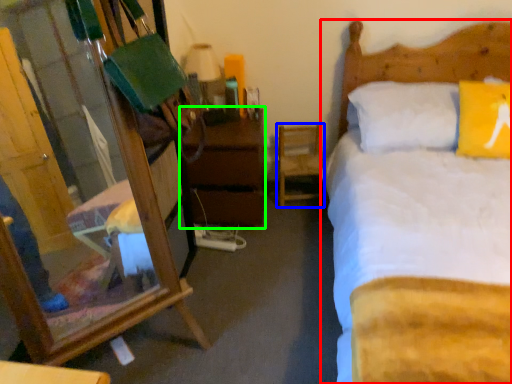
Question: Considering the real-world distances, which object is farthest from bed (highlighted by a red box)? chair (highlighted by a blue box) or nightstand (highlighted by a green box)?

Choices:
 (A) chair
 (B) nightstand

Answer: (B)